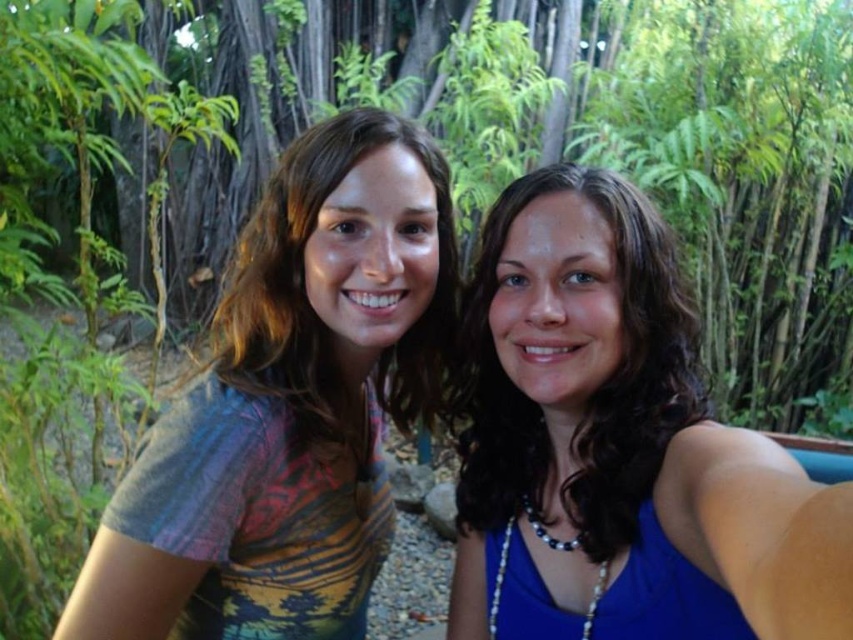
Question: Can you confirm if green leafy tree at center is positioned above blue silk tank top at center?

Choices:
 (A) yes
 (B) no

Answer: (A)

Question: Among these points, which one is farthest from the camera?

Choices:
 (A) (297, 262)
 (B) (566, 3)
 (C) (265, 285)
 (D) (643, 451)

Answer: (B)

Question: Is blue silk tank top at center thinner than multicolored fabric shirt at left?

Choices:
 (A) yes
 (B) no

Answer: (A)

Question: Can you confirm if multicolored fabric shirt at left is positioned below multicolored fabric at center?

Choices:
 (A) yes
 (B) no

Answer: (A)

Question: Among these points, which one is nearest to the camera?

Choices:
 (A) [x=706, y=13]
 (B) [x=363, y=460]

Answer: (B)

Question: Which object is the closest to the green leafy tree at center?

Choices:
 (A) multicolored fabric shirt at left
 (B) multicolored fabric at center

Answer: (A)